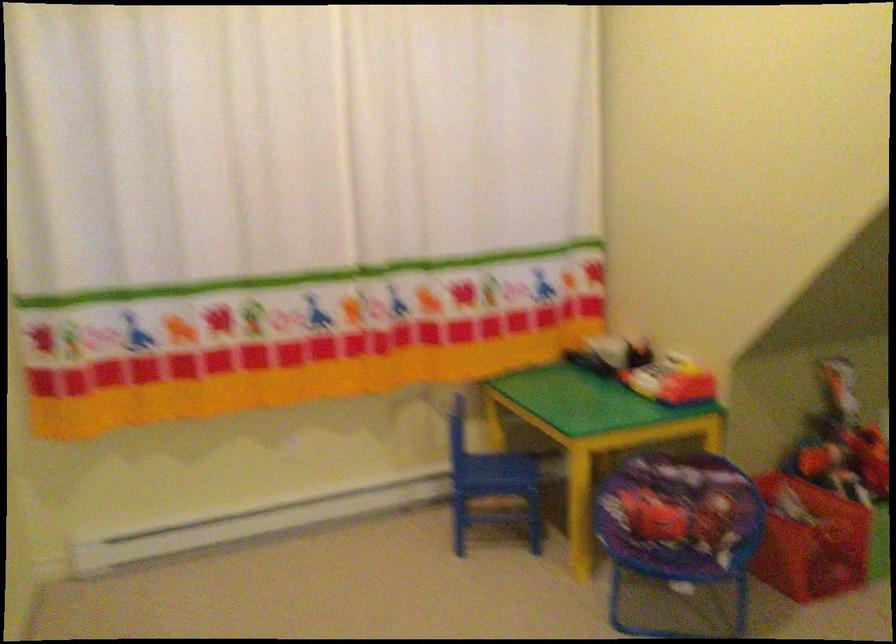
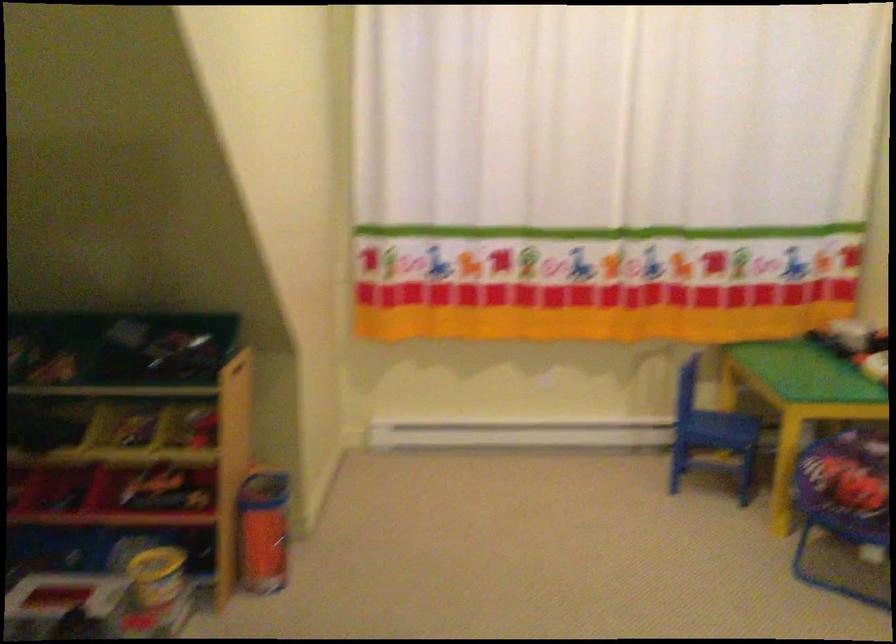
In the second image, find the point that corresponds to point 494,476 in the first image.

(718, 430)